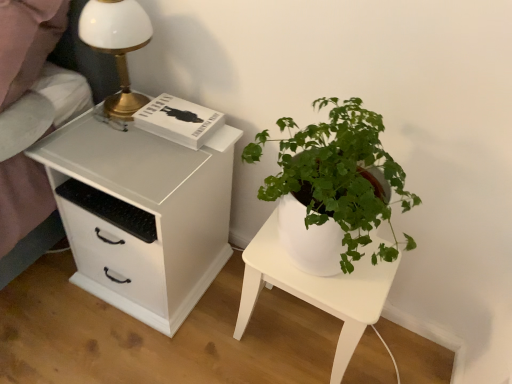
Identify the location of vacant location below white glossy nightstand at lower right (from a real-world perspective). (294, 332).